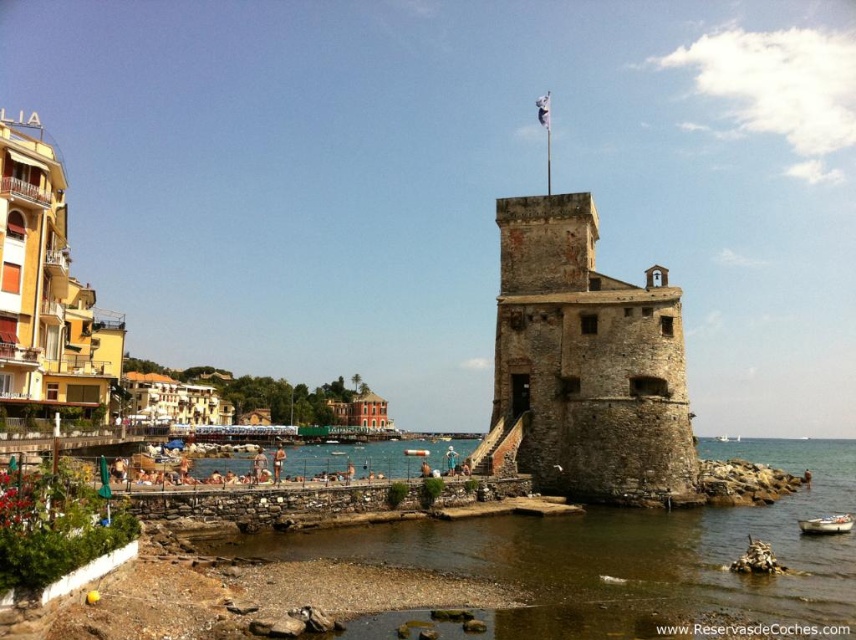
Question: Does clear water at lower center come behind rusty stone tower at center?

Choices:
 (A) no
 (B) yes

Answer: (A)

Question: Does rusty stone tower at center have a smaller size compared to white plastic buoy at center?

Choices:
 (A) no
 (B) yes

Answer: (A)

Question: Which object is farther from the camera taking this photo?

Choices:
 (A) clear water at lower center
 (B) white plastic buoy at center
 (C) rusty stone tower at center

Answer: (B)

Question: Is rusty stone tower at center closer to the viewer compared to white wooden boat at lower right?

Choices:
 (A) no
 (B) yes

Answer: (A)

Question: Which object is positioned farthest from the clear water at lower center?

Choices:
 (A) white wooden boat at lower right
 (B) rusty stone tower at center

Answer: (A)

Question: Which point is closer to the camera taking this photo?

Choices:
 (A) (408, 451)
 (B) (783, 554)
 (C) (816, 532)
 (D) (510, 262)

Answer: (B)